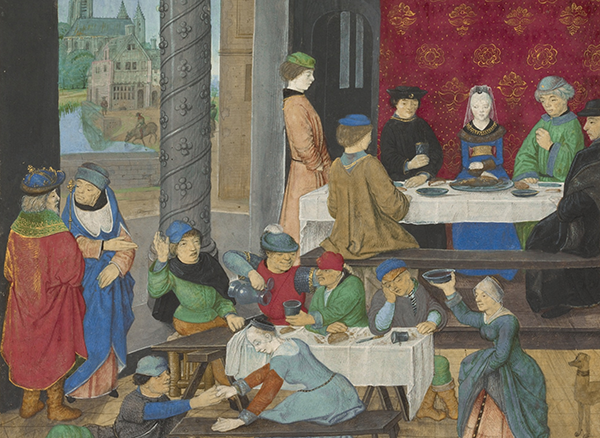
This screenshot has height=438, width=600. In order to click on pillar in this screenshot , I will do `click(184, 120)`.